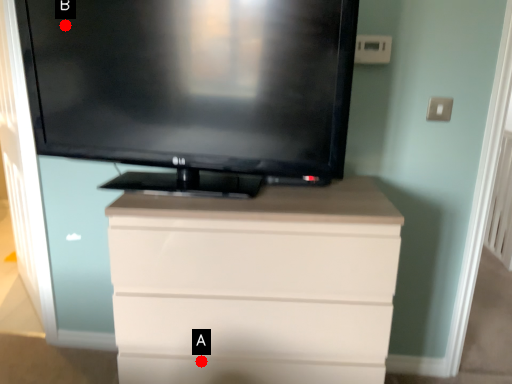
Question: Two points are circled on the image, labeled by A and B beside each circle. Which point is closer to the camera?

Choices:
 (A) A is closer
 (B) B is closer

Answer: (A)